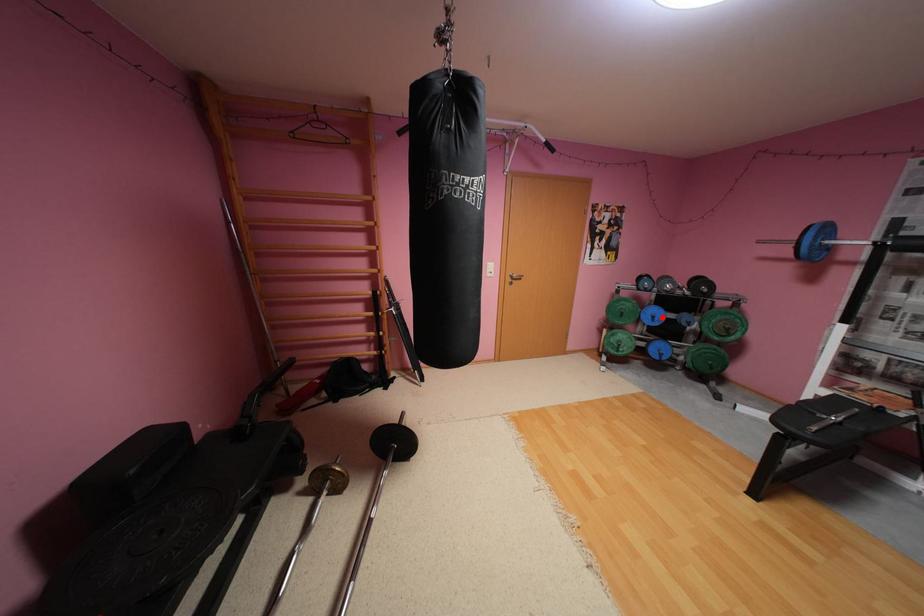
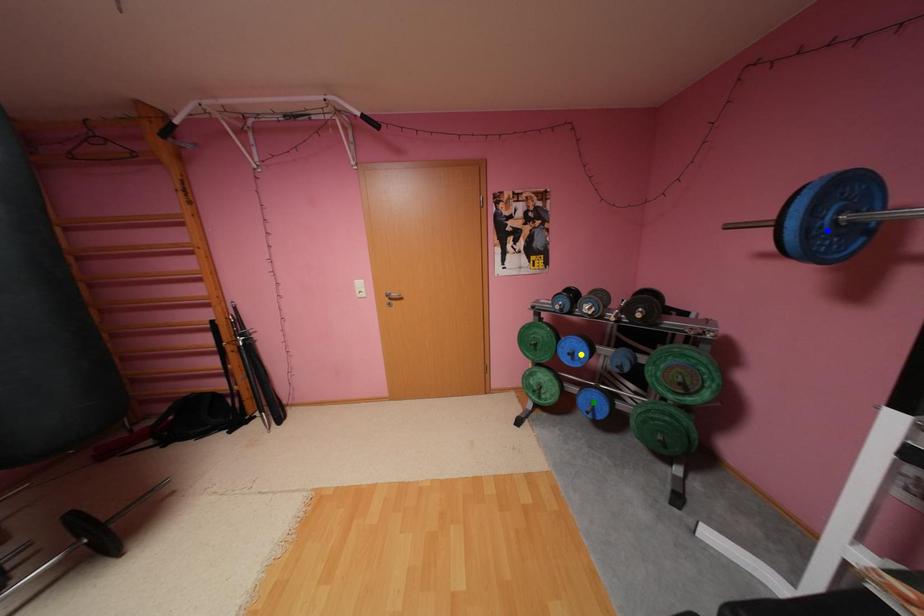
Question: I am providing you with two images of the same scene from different viewpoints. A red point is marked on the first image. You are given multiple points on the second image. In image 2, which mark is for the same physical point as the one in image 1?

Choices:
 (A) blue point
 (B) yellow point
 (C) green point

Answer: (B)